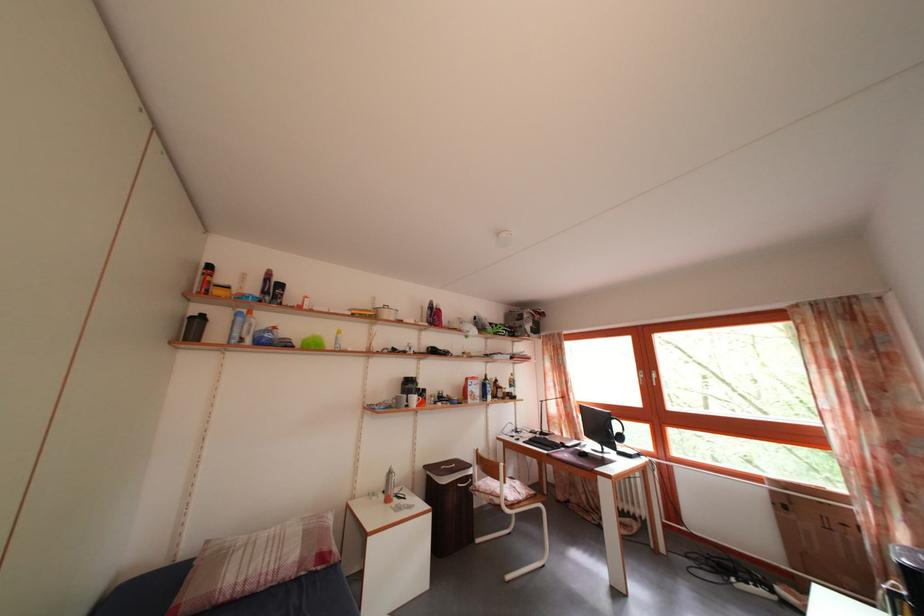
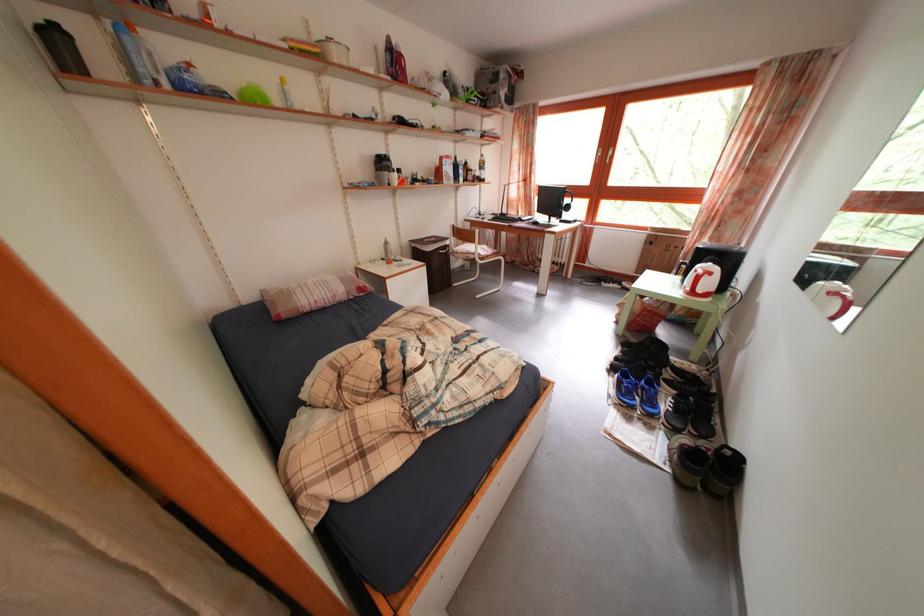
Question: How did the camera likely rotate?

Choices:
 (A) Left
 (B) Right
 (C) Up
 (D) Down

Answer: (D)